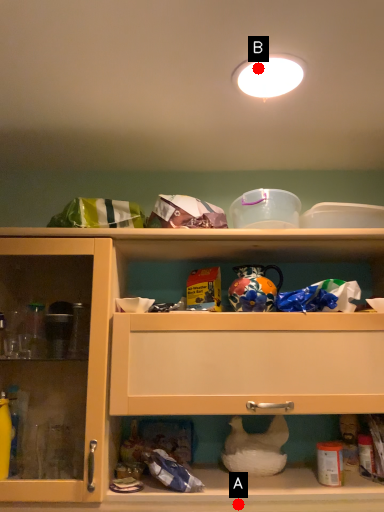
Question: Two points are circled on the image, labeled by A and B beside each circle. Among these points, which one is farthest from the camera?

Choices:
 (A) A is further
 (B) B is further

Answer: (A)